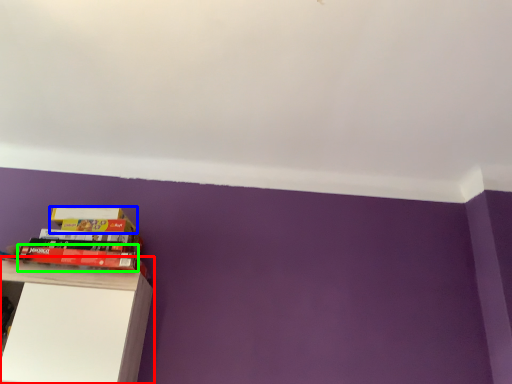
Question: Considering the real-world distances, which object is closest to shelf (highlighted by a red box)? paperback book (highlighted by a blue box) or paperback book (highlighted by a green box).

Choices:
 (A) paperback book
 (B) paperback book

Answer: (B)